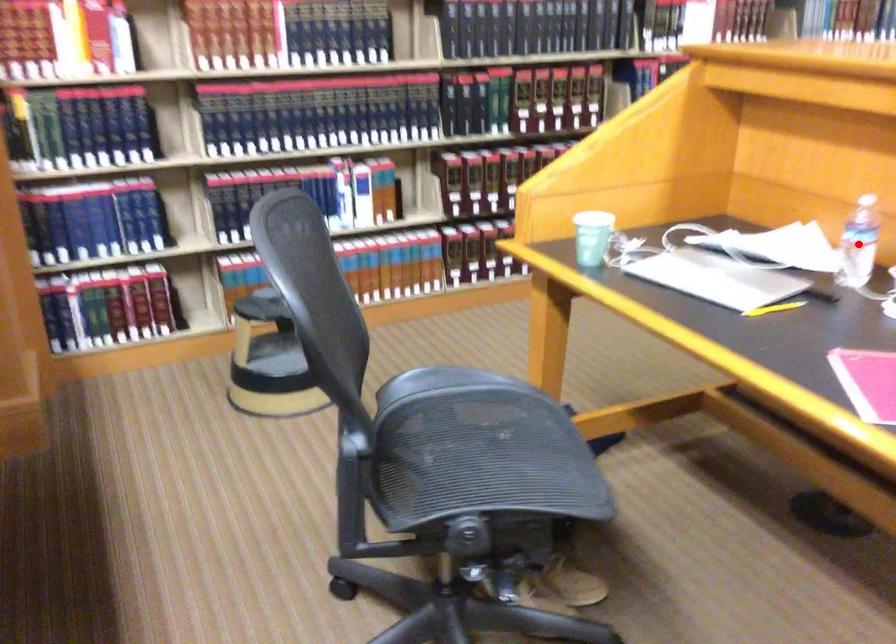
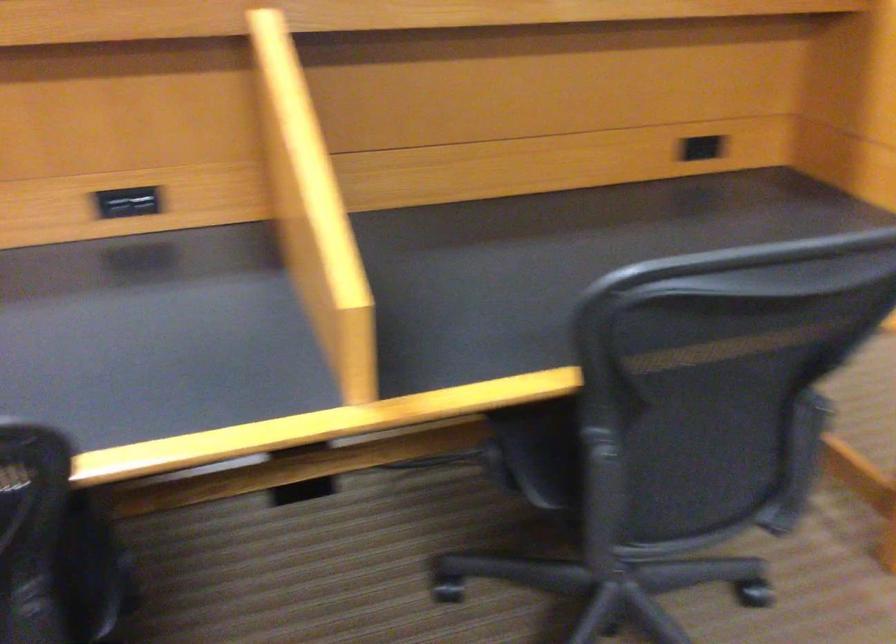
Question: I am providing you with two images of the same scene from different viewpoints. A red point is marked on the first image. Is the red point's position out of view in image 2?

Choices:
 (A) Yes
 (B) No

Answer: (A)